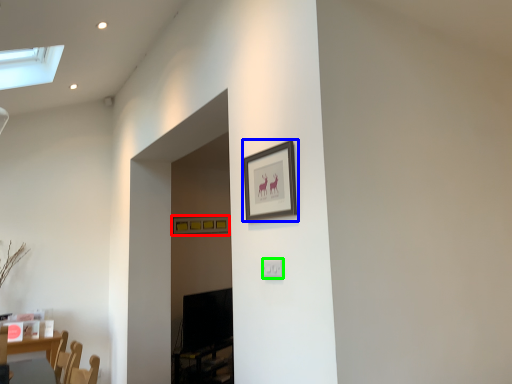
Question: Which object is positioned farthest from picture frame (highlighted by a red box)? Select from picture frame (highlighted by a blue box) and electric outlet (highlighted by a green box).

Choices:
 (A) picture frame
 (B) electric outlet

Answer: (B)